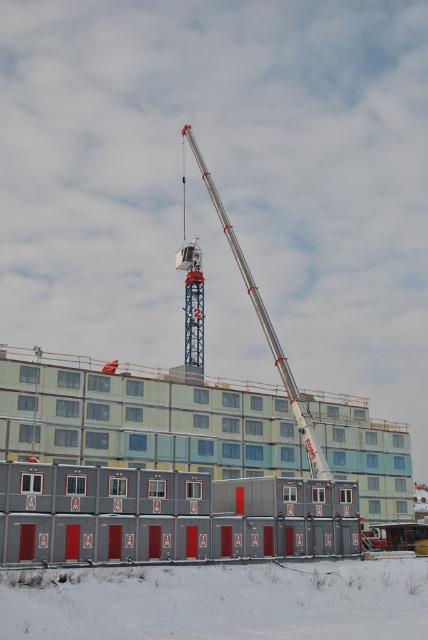
Is point (410, 604) in front of point (288, 396)?

That is True.

Is white powdery snow at lower center positioned before silver metallic crane at center?

Yes, it is.

Identify the location of white powdery snow at lower center. The image size is (428, 640). (219, 602).